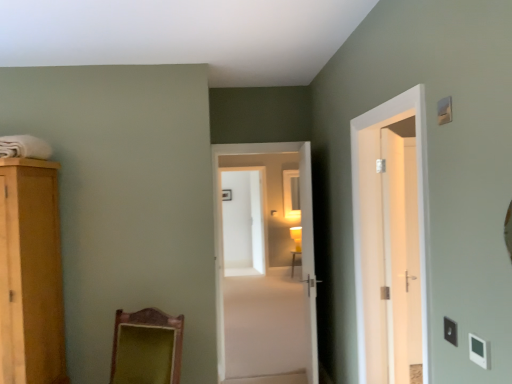
Question: Considering the relative positions of white plastic light switch at lower right, the 2th light switch ordered from the bottom, and matte yellow lampshade at center in the image provided, is white plastic light switch at lower right, the 2th light switch ordered from the bottom, to the left of matte yellow lampshade at center from the viewer's perspective?

Choices:
 (A) no
 (B) yes

Answer: (B)

Question: Is white plastic light switch at lower right, the 2th light switch ordered from the bottom, bigger than matte yellow lampshade at center?

Choices:
 (A) yes
 (B) no

Answer: (B)

Question: From the image's perspective, does white plastic light switch at lower right, the second light switch positioned from the top, appear lower than matte yellow lampshade at center?

Choices:
 (A) yes
 (B) no

Answer: (B)

Question: From a real-world perspective, is white plastic light switch at lower right, acting as the 1th light switch starting from the back, physically below matte yellow lampshade at center?

Choices:
 (A) yes
 (B) no

Answer: (B)

Question: Considering the relative positions of white plastic light switch at lower right, acting as the 1th light switch starting from the back, and matte yellow lampshade at center in the image provided, is white plastic light switch at lower right, acting as the 1th light switch starting from the back, in front of matte yellow lampshade at center?

Choices:
 (A) yes
 (B) no

Answer: (A)

Question: In the image, is matte glass mirror at center on the left side or the right side of matte wooden table at center?

Choices:
 (A) right
 (B) left

Answer: (B)

Question: Which is correct: matte glass mirror at center is inside matte wooden table at center, or outside of it?

Choices:
 (A) inside
 (B) outside

Answer: (B)

Question: Looking at the image, does matte glass mirror at center seem bigger or smaller compared to matte wooden table at center?

Choices:
 (A) small
 (B) big

Answer: (A)

Question: From their relative heights in the image, would you say matte glass mirror at center is taller or shorter than matte wooden table at center?

Choices:
 (A) short
 (B) tall

Answer: (B)

Question: Looking at the image, does white glossy door at right, acting as the fourth door starting from the left, seem bigger or smaller compared to matte wooden table at center?

Choices:
 (A) big
 (B) small

Answer: (B)

Question: From the image's perspective, is white glossy door at right, arranged as the first door when viewed from the back, above or below matte wooden table at center?

Choices:
 (A) above
 (B) below

Answer: (A)

Question: Is point (406, 324) positioned closer to the camera than point (291, 264)?

Choices:
 (A) closer
 (B) farther

Answer: (A)

Question: Is white glossy door at right, arranged as the first door when viewed from the back, to the left or to the right of matte wooden table at center in the image?

Choices:
 (A) right
 (B) left

Answer: (A)

Question: Relative to white glossy screen door at center, is white plastic light switch at lower right, arranged as the 1th light switch when ordered from the bottom, in front or behind?

Choices:
 (A) behind
 (B) front

Answer: (B)

Question: Is point (488, 354) closer or farther from the camera than point (263, 264)?

Choices:
 (A) farther
 (B) closer

Answer: (B)